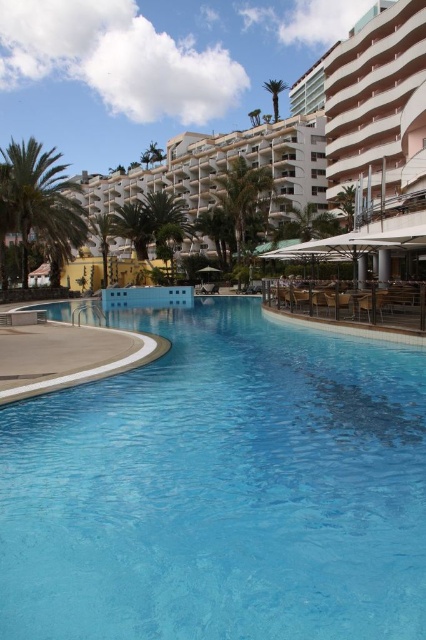
Question: Does white glossy building at upper center appear on the right side of green leafy palm tree at left?

Choices:
 (A) yes
 (B) no

Answer: (B)

Question: Which of the following is the farthest from the observer?

Choices:
 (A) (103, 257)
 (B) (180, 504)
 (C) (354, 186)

Answer: (C)

Question: Which point appears closest to the camera in this image?

Choices:
 (A) (334, 198)
 (B) (112, 234)
 (C) (137, 513)

Answer: (C)

Question: Which point appears closest to the camera in this image?

Choices:
 (A) (354, 202)
 (B) (46, 179)
 (C) (276, 115)
 (D) (227, 138)

Answer: (B)

Question: From the image, what is the correct spatial relationship of transparent glass pool at center in relation to white glossy building at upper center?

Choices:
 (A) below
 (B) above

Answer: (A)

Question: Is white glossy building at upper center above green leafy palm tree at center?

Choices:
 (A) no
 (B) yes

Answer: (B)